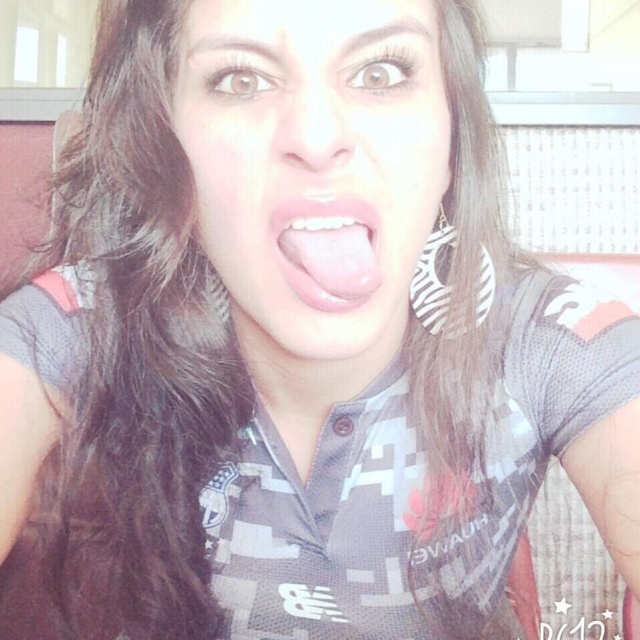
Question: Can you confirm if matte skin face at center is positioned to the left of pink glossy tongue at center?

Choices:
 (A) yes
 (B) no

Answer: (A)

Question: Which point is closer to the camera?

Choices:
 (A) [333, 84]
 (B) [348, 269]

Answer: (B)

Question: From the image, what is the correct spatial relationship of matte skin face at center in relation to pink glossy tongue at center?

Choices:
 (A) right
 (B) left

Answer: (B)

Question: Does matte skin face at center lie behind pink glossy tongue at center?

Choices:
 (A) no
 (B) yes

Answer: (A)

Question: Which point appears farthest from the camera in this image?

Choices:
 (A) (317, 227)
 (B) (340, 296)

Answer: (A)